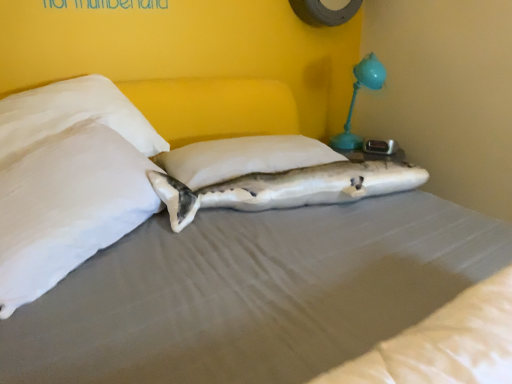
What do you see at coordinates (355, 98) in the screenshot? I see `teal plastic table lamp at upper right` at bounding box center [355, 98].

What do you see at coordinates (287, 187) in the screenshot? I see `white fabric shark at center` at bounding box center [287, 187].

Locate an element on the screen. teal plastic table lamp at upper right is located at coordinates (355, 98).

Is teal plastic table lamp at upper right facing away from white soft pillow at center, which appears as the 1th pillow when viewed from the right?

That's not correct — teal plastic table lamp at upper right is not looking away from white soft pillow at center, which appears as the 1th pillow when viewed from the right.

Looking at this image, which is correct: teal plastic table lamp at upper right is inside white soft pillow at center, which appears as the 1th pillow when viewed from the right, or outside of it?

teal plastic table lamp at upper right is spatially situated outside white soft pillow at center, which appears as the 1th pillow when viewed from the right.

Considering the sizes of teal plastic table lamp at upper right and white soft pillow at center, the 2th pillow viewed from the left, in the image, is teal plastic table lamp at upper right bigger or smaller than white soft pillow at center, the 2th pillow viewed from the left,?

teal plastic table lamp at upper right is bigger than white soft pillow at center, the 2th pillow viewed from the left.

Are teal plastic table lamp at upper right and white soft pillow at center, the 2th pillow viewed from the left, making contact?

No, teal plastic table lamp at upper right is not making contact with white soft pillow at center, the 2th pillow viewed from the left.

Does white soft pillow at center, which appears as the 1th pillow when viewed from the right, lie behind white soft pillow at left, the 2th pillow from the right?

Yes, it is behind white soft pillow at left, the 2th pillow from the right.

Identify the location of pillow below the white soft pillow at left, the 2th pillow from the right (from a real-world perspective). (242, 157).

Measure the distance from white soft pillow at center, which appears as the 1th pillow when viewed from the right, to white soft pillow at left, the 2th pillow from the right.

A distance of 14.11 inches exists between white soft pillow at center, which appears as the 1th pillow when viewed from the right, and white soft pillow at left, the 2th pillow from the right.

From the image's perspective, is white soft pillow at center, which appears as the 1th pillow when viewed from the right, over white soft pillow at left, the 2th pillow from the right?

Correct, white soft pillow at center, which appears as the 1th pillow when viewed from the right, appears higher than white soft pillow at left, the 2th pillow from the right, in the image.

From the image's perspective, count 2nd pillows downward from the teal plastic table lamp at upper right and point to it. Please provide its 2D coordinates.

[(67, 207)]

Based on the photo, from the image's perspective, does teal plastic table lamp at upper right appear lower than white soft pillow at left, which appears as the first pillow when viewed from the left?

No.

In the scene shown: Which is in front, teal plastic table lamp at upper right or white soft pillow at left, which appears as the first pillow when viewed from the left?

white soft pillow at left, which appears as the first pillow when viewed from the left.

Is teal plastic table lamp at upper right facing away from white soft pillow at left, which appears as the first pillow when viewed from the left?

teal plastic table lamp at upper right is not turned away from white soft pillow at left, which appears as the first pillow when viewed from the left.

Is white soft pillow at left, which appears as the first pillow when viewed from the left, at the right side of teal plastic table lamp at upper right?

Incorrect, white soft pillow at left, which appears as the first pillow when viewed from the left, is not on the right side of teal plastic table lamp at upper right.

From a real-world perspective, between white soft pillow at left, which appears as the first pillow when viewed from the left, and teal plastic table lamp at upper right, who is vertically higher?

teal plastic table lamp at upper right.

Between white soft pillow at left, the 2th pillow from the right, and teal plastic table lamp at upper right, which one has larger width?

white soft pillow at left, the 2th pillow from the right.

Which point is more distant from viewer, (295, 186) or (355, 68)?

The point (355, 68) is farther from the camera.

From the image's perspective, relative to teal plastic table lamp at upper right, is white fabric shark at center above or below?

From the image's perspective, white fabric shark at center appears below teal plastic table lamp at upper right.

Which of these two, white fabric shark at center or teal plastic table lamp at upper right, is wider?

With larger width is teal plastic table lamp at upper right.

From a real-world perspective, does white fabric shark at center stand above teal plastic table lamp at upper right?

No, from a real-world perspective, white fabric shark at center is not on top of teal plastic table lamp at upper right.

Can you tell me how much white fabric shark at center and white soft pillow at left, the 2th pillow from the right, differ in facing direction?

There is a 34.1-degree angle between the facing directions of white fabric shark at center and white soft pillow at left, the 2th pillow from the right.

From a real-world perspective, is white fabric shark at center on white soft pillow at left, which appears as the first pillow when viewed from the left?

No, from a real-world perspective, white fabric shark at center is not on top of white soft pillow at left, which appears as the first pillow when viewed from the left.

Is white fabric shark at center surrounding white soft pillow at left, which appears as the first pillow when viewed from the left?

No.

The image size is (512, 384). Identify the location of pillow lying in front of the white fabric shark at center. (67, 207).

Considering the relative positions of white soft pillow at center, the 2th pillow viewed from the left, and white fabric shark at center in the image provided, is white soft pillow at center, the 2th pillow viewed from the left, to the right of white fabric shark at center from the viewer's perspective?

In fact, white soft pillow at center, the 2th pillow viewed from the left, is to the left of white fabric shark at center.

Where is `shark on the right of white soft pillow at center, the 2th pillow viewed from the left`? The image size is (512, 384). shark on the right of white soft pillow at center, the 2th pillow viewed from the left is located at coordinates (287, 187).

From the image's perspective, starting from the teal plastic table lamp at upper right, which pillow is the 1st one below? Please provide its 2D coordinates.

[(242, 157)]

Locate an element on the screen. pillow in front of the white soft pillow at center, which appears as the 1th pillow when viewed from the right is located at coordinates (67, 207).

From the image, which object appears to be farther from teal plastic table lamp at upper right, white soft pillow at left, the 2th pillow from the right, or white fabric shark at center?

white soft pillow at left, the 2th pillow from the right, is further to teal plastic table lamp at upper right.

Based on their spatial positions, is white soft pillow at left, which appears as the first pillow when viewed from the left, or teal plastic table lamp at upper right closer to white soft pillow at center, the 2th pillow viewed from the left?

white soft pillow at left, which appears as the first pillow when viewed from the left, is closer to white soft pillow at center, the 2th pillow viewed from the left.

When comparing their distances from white soft pillow at left, which appears as the first pillow when viewed from the left, does white soft pillow at center, the 2th pillow viewed from the left, or white fabric shark at center seem closer?

Among the two, white fabric shark at center is located nearer to white soft pillow at left, which appears as the first pillow when viewed from the left.

Based on their spatial positions, is teal plastic table lamp at upper right or white soft pillow at center, which appears as the 1th pillow when viewed from the right, further from white soft pillow at left, the 2th pillow from the right?

Among the two, teal plastic table lamp at upper right is located further to white soft pillow at left, the 2th pillow from the right.

Looking at the image, which one is located further to white soft pillow at center, the 2th pillow viewed from the left, teal plastic table lamp at upper right or white fabric shark at center?

The object further to white soft pillow at center, the 2th pillow viewed from the left, is teal plastic table lamp at upper right.

Estimate the real-world distances between objects in this image. Which object is further from teal plastic table lamp at upper right, white soft pillow at center, the 2th pillow viewed from the left, or white soft pillow at left, the 2th pillow from the right?

The object further to teal plastic table lamp at upper right is white soft pillow at left, the 2th pillow from the right.

Which object lies further to the anchor point white soft pillow at center, the 2th pillow viewed from the left, white fabric shark at center or teal plastic table lamp at upper right?

teal plastic table lamp at upper right lies further to white soft pillow at center, the 2th pillow viewed from the left, than the other object.

Which object lies nearer to the anchor point white soft pillow at center, the 2th pillow viewed from the left, white soft pillow at left, which appears as the first pillow when viewed from the left, or white fabric shark at center?

white fabric shark at center lies closer to white soft pillow at center, the 2th pillow viewed from the left, than the other object.

Where is `pillow between white soft pillow at left, which appears as the first pillow when viewed from the left, and white fabric shark at center`? pillow between white soft pillow at left, which appears as the first pillow when viewed from the left, and white fabric shark at center is located at coordinates (242, 157).

Locate an element on the screen. The height and width of the screenshot is (384, 512). pillow between white fabric shark at center and teal plastic table lamp at upper right along the z-axis is located at coordinates (242, 157).

The image size is (512, 384). I want to click on pillow located between white soft pillow at left, the 2th pillow from the right, and teal plastic table lamp at upper right in the depth direction, so click(x=242, y=157).

The height and width of the screenshot is (384, 512). I want to click on shark between white soft pillow at left, the 2th pillow from the right, and teal plastic table lamp at upper right from front to back, so click(x=287, y=187).